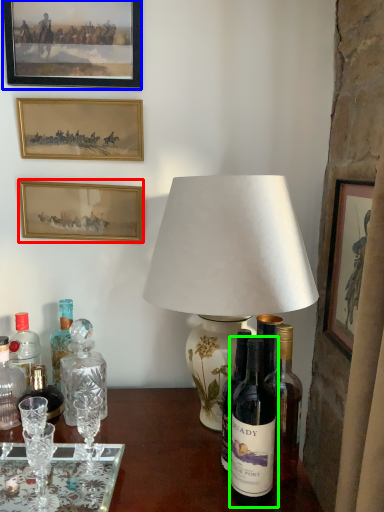
Question: Which is nearer to the picture frame (highlighted by a red box)? picture frame (highlighted by a blue box) or bottle (highlighted by a green box).

Choices:
 (A) picture frame
 (B) bottle

Answer: (A)